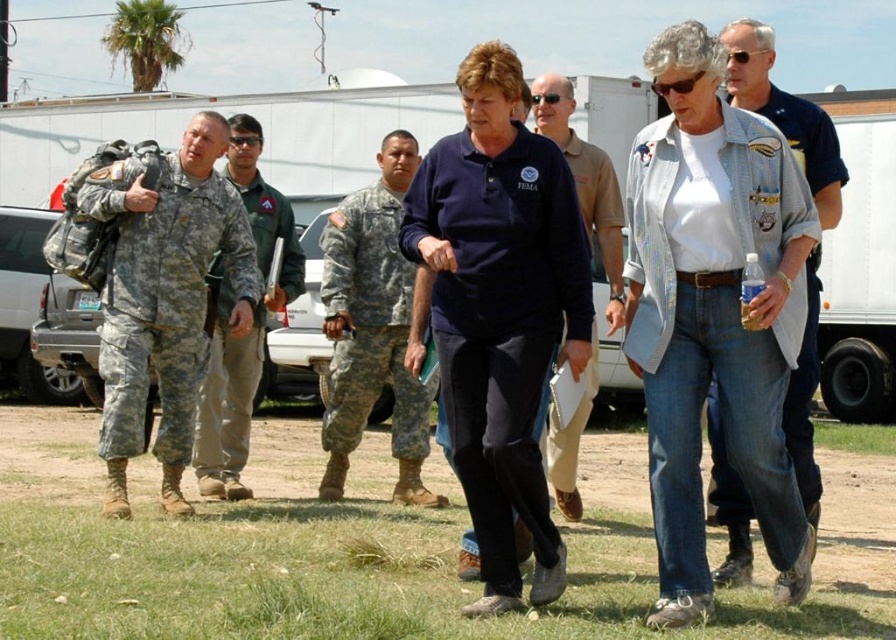
Question: Which point is farther to the camera?

Choices:
 (A) camouflage uniform at center
 (B) denim jacket at right
 (C) denim jacket at center
 (D) camouflage uniform at left

Answer: (A)

Question: Is denim jacket at center thinner than navy blue cotton shirt at center?

Choices:
 (A) no
 (B) yes

Answer: (B)

Question: Does navy blue cotton shirt at center come in front of camouflage uniform at left?

Choices:
 (A) no
 (B) yes

Answer: (B)

Question: Among these points, which one is nearest to the camera?

Choices:
 (A) (449, 148)
 (B) (588, 180)
 (C) (76, 504)

Answer: (A)

Question: Among these objects, which one is farthest from the camera?

Choices:
 (A) camouflage fabric uniform at left
 (B) denim jacket at center
 (C) dirt field at lower center
 (D) camouflage uniform at center

Answer: (D)

Question: Where is denim jacket at right located in relation to camouflage uniform at left in the image?

Choices:
 (A) below
 (B) above

Answer: (B)